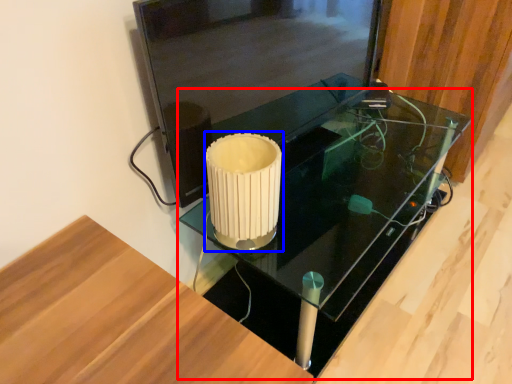
Question: Which point is closer to the camera, table (highlighted by a red box) or candle holder (highlighted by a blue box)?

Choices:
 (A) table
 (B) candle holder

Answer: (B)